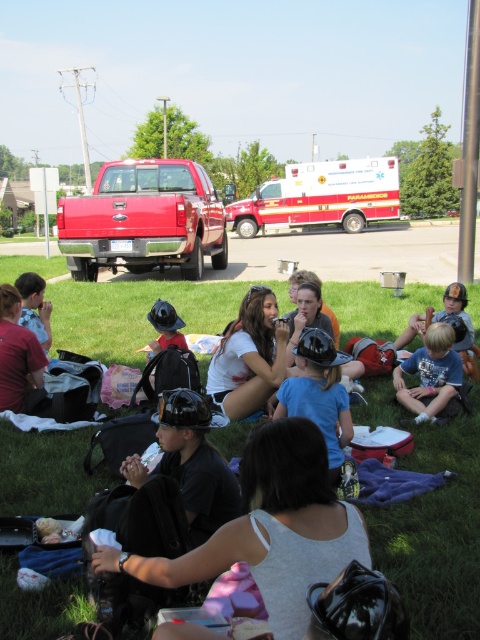
You are a child at the picnic and want to grab the black matte helmet at center. However, there is another matte black helmet at center in the way. Which helmet should you pick up first to reach the one you want?

You should pick up the matte black helmet at center first because the black matte helmet at center is closer to you. Removing the farther one first would allow access to the closer one.

You are a child at the picnic and want to throw a ball from your position to the cooler located at point (21,348). There is a friend standing at point (219,401). Will the ball pass in front of or behind your friend?

The ball will pass in front of your friend because point (219,401) is in front of point (21,348).